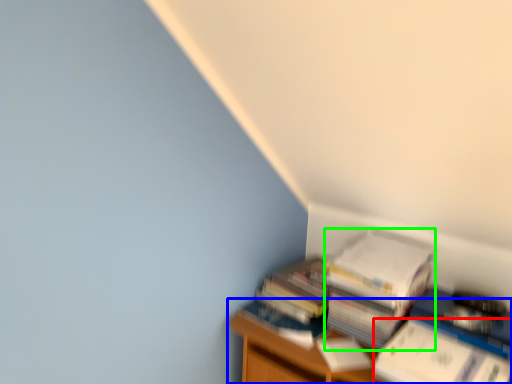
Question: Considering the real-world distances, which object is farthest from paperback book (highlighted by a red box)? furniture (highlighted by a blue box) or paperback book (highlighted by a green box)?

Choices:
 (A) furniture
 (B) paperback book

Answer: (A)